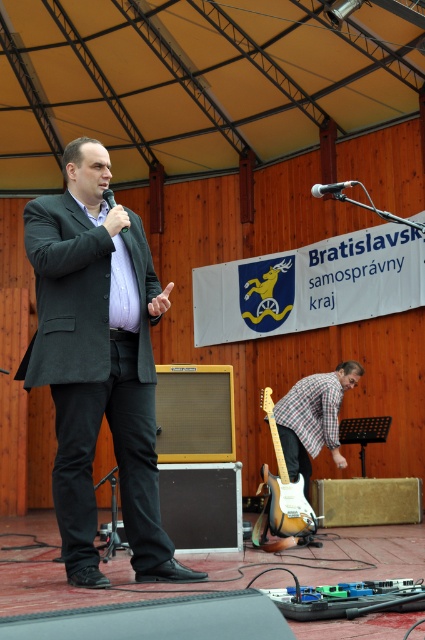
Based on the provided scene description, what are the coordinates of the matte black suit at center?

The coordinates of the matte black suit at center are at point (98,362).

You are a stagehand setting up equipment for a performance. You need to place the sunburst wood electric guitar at lower center and the matte black microphone at upper center on a shelf. The shelf has a height limit of 50 cm. Can you fit both items vertically without exceeding the shelf height?

The sunburst wood electric guitar at lower center is larger in size than the matte black microphone at upper center. Since the guitar is larger, it is likely taller than the microphone. If the guitar exceeds 50 cm in height, it would not fit on the shelf. However, without specific height measurements, we cannot definitively determine if both items will fit vertically within the 50 cm limit.

You are an event photographer at the Bratislava Self Governing Region event. You need to take a photo of the speaker wearing the matte black suit at center and holding the metallic silver microphone at upper center. Based on their positions, will the microphone be visible in the photo if you focus on the speaker?

The matte black suit at center is to the left of the metallic silver microphone at upper center. Since the microphone is positioned to the right of the speaker, it will be visible in the photo when focusing on the speaker.